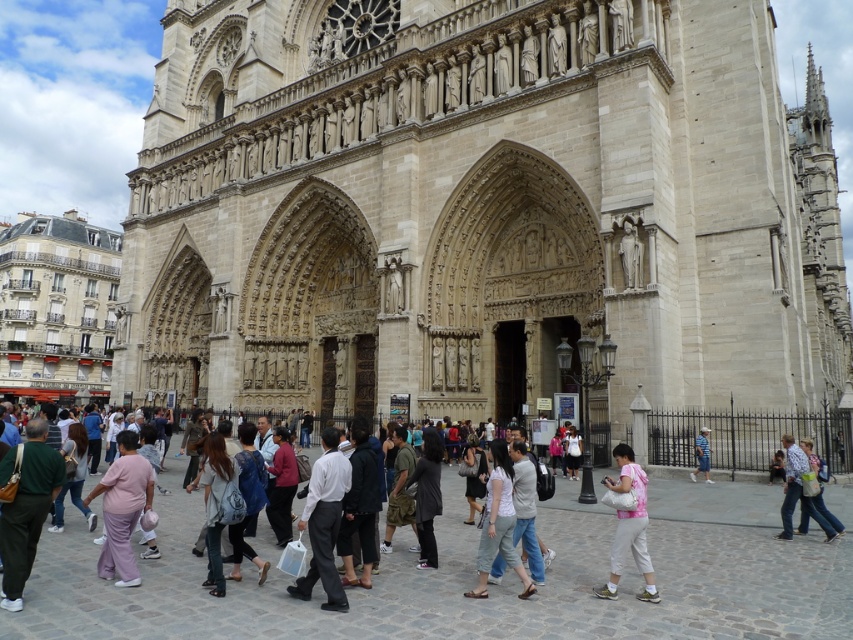
Question: Does light blue jeans at center have a larger size compared to blue denim jeans at lower right?

Choices:
 (A) no
 (B) yes

Answer: (B)

Question: Can you confirm if beige stone church at center is smaller than dark gray fabric dress at center?

Choices:
 (A) yes
 (B) no

Answer: (B)

Question: Estimate the real-world distances between objects in this image. Which object is closer to the pink fabric purse at center?

Choices:
 (A) light blue jeans at center
 (B) light gray stone building at left
 (C) blue denim jeans at lower right

Answer: (A)

Question: Can you confirm if light gray stone building at left is positioned to the left of dark gray fabric dress at center?

Choices:
 (A) yes
 (B) no

Answer: (A)

Question: Which point is closer to the camera?

Choices:
 (A) light blue jeans at center
 (B) dark gray fabric dress at center
 (C) light gray stone building at left
 (D) beige stone church at center

Answer: (A)

Question: Estimate the real-world distances between objects in this image. Which object is closer to the pink fabric purse at center?

Choices:
 (A) light gray stone building at left
 (B) dark gray fabric dress at center

Answer: (B)